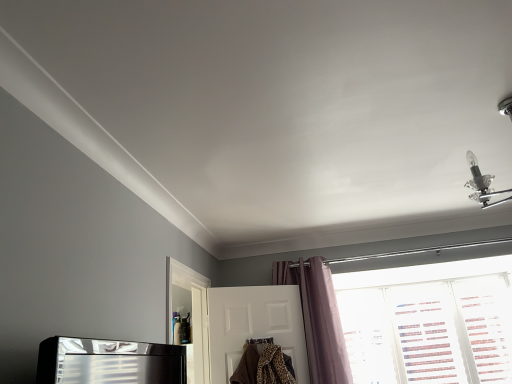
Question: Is purple velvet curtain at center outside transparent plastic screen door at lower left?

Choices:
 (A) no
 (B) yes

Answer: (B)

Question: From the image's perspective, is purple velvet curtain at center over transparent plastic screen door at lower left?

Choices:
 (A) yes
 (B) no

Answer: (B)

Question: Considering the relative sizes of purple velvet curtain at center and transparent plastic screen door at lower left in the image provided, is purple velvet curtain at center bigger than transparent plastic screen door at lower left?

Choices:
 (A) no
 (B) yes

Answer: (B)

Question: Considering the relative positions of purple velvet curtain at center and transparent plastic screen door at lower left in the image provided, is purple velvet curtain at center to the right of transparent plastic screen door at lower left from the viewer's perspective?

Choices:
 (A) yes
 (B) no

Answer: (A)

Question: Is purple velvet curtain at center placed right next to transparent plastic screen door at lower left?

Choices:
 (A) yes
 (B) no

Answer: (B)

Question: Is transparent plastic screen door at lower left wider or thinner than white textured blinds at lower right?

Choices:
 (A) thin
 (B) wide

Answer: (B)

Question: Considering their positions, is transparent plastic screen door at lower left located in front of or behind white textured blinds at lower right?

Choices:
 (A) front
 (B) behind

Answer: (A)

Question: Based on their sizes in the image, would you say transparent plastic screen door at lower left is bigger or smaller than white textured blinds at lower right?

Choices:
 (A) small
 (B) big

Answer: (A)

Question: From the image's perspective, relative to white textured blinds at lower right, is transparent plastic screen door at lower left above or below?

Choices:
 (A) above
 (B) below

Answer: (A)

Question: Is white matte door at center wider or thinner than transparent plastic screen door at lower left?

Choices:
 (A) wide
 (B) thin

Answer: (B)

Question: Considering the relative positions of white matte door at center and transparent plastic screen door at lower left in the image provided, is white matte door at center to the left or to the right of transparent plastic screen door at lower left?

Choices:
 (A) left
 (B) right

Answer: (B)

Question: From a real-world perspective, is white matte door at center physically located above or below transparent plastic screen door at lower left?

Choices:
 (A) above
 (B) below

Answer: (B)

Question: In terms of height, does white matte door at center look taller or shorter compared to transparent plastic screen door at lower left?

Choices:
 (A) short
 (B) tall

Answer: (A)

Question: Looking at their shapes, would you say transparent plastic screen door at lower left is wider or thinner than purple velvet curtain at center?

Choices:
 (A) wide
 (B) thin

Answer: (B)

Question: Do you think transparent plastic screen door at lower left is within purple velvet curtain at center, or outside of it?

Choices:
 (A) inside
 (B) outside

Answer: (B)